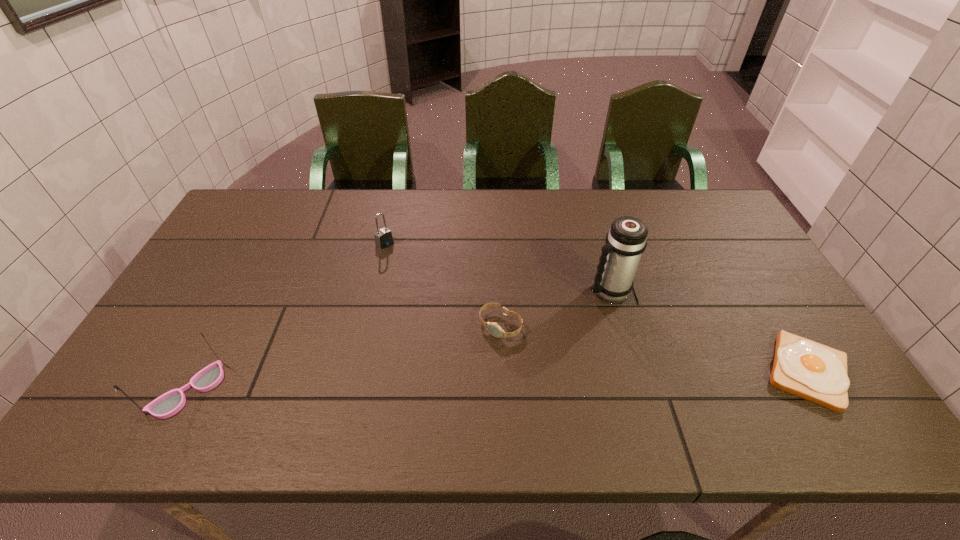
Where is `free space that is in between the leftmost object and the second object from right to left`? free space that is in between the leftmost object and the second object from right to left is located at coordinates (398, 341).

At what (x,y) coordinates should I click in order to perform the action: click on free space between the second farthest object and the third object from left to right. Please return your answer as a coordinate pair (x, y). Looking at the image, I should click on (554, 308).

The width and height of the screenshot is (960, 540). In order to click on unoccupied area between the third object from left to right and the rightmost object in this screenshot , I will do `click(654, 348)`.

Identify the location of vacant area that lies between the second object from left to right and the second tallest object. (286, 318).

In order to click on object that is the fourth closest to the third object from left to right in this screenshot , I will do `click(170, 403)`.

Locate which object is the closest to the padlock. Please provide its 2D coordinates. Your answer should be formatted as a tuple, i.e. [(x, y)], where the tuple contains the x and y coordinates of a point satisfying the conditions above.

[(494, 329)]

In order to click on vacant area in the image that satisfies the following two spatial constraints: 1. on the front side of the fourth tallest object; 2. on the right side of the fourth object from right to left in this screenshot , I will do tap(366, 326).